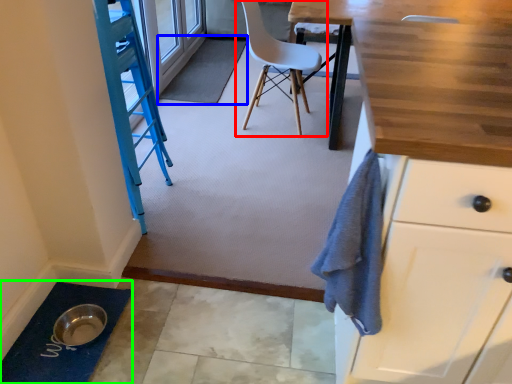
Question: Which is nearer to the chair (highlighted by a red box)? bath mat (highlighted by a blue box) or bath mat (highlighted by a green box).

Choices:
 (A) bath mat
 (B) bath mat

Answer: (A)